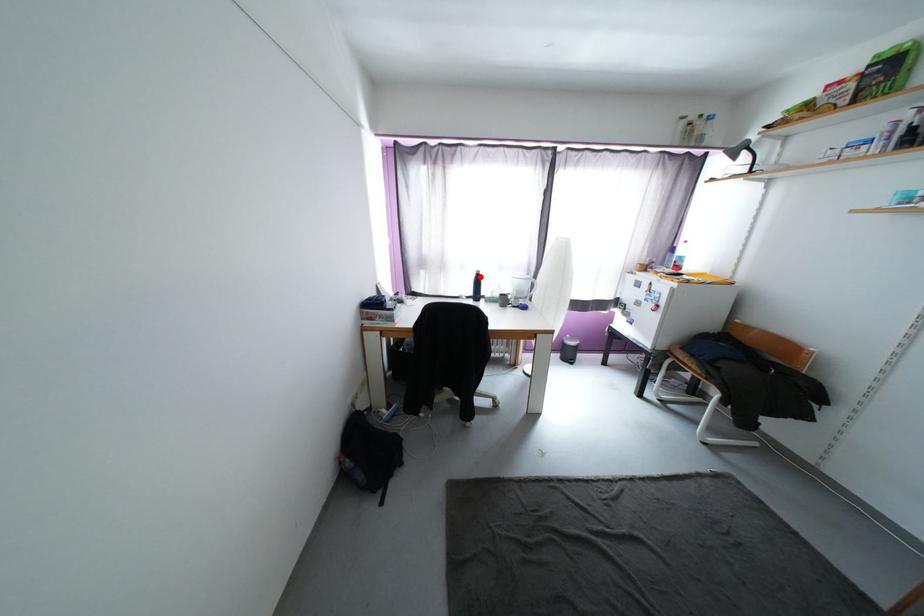
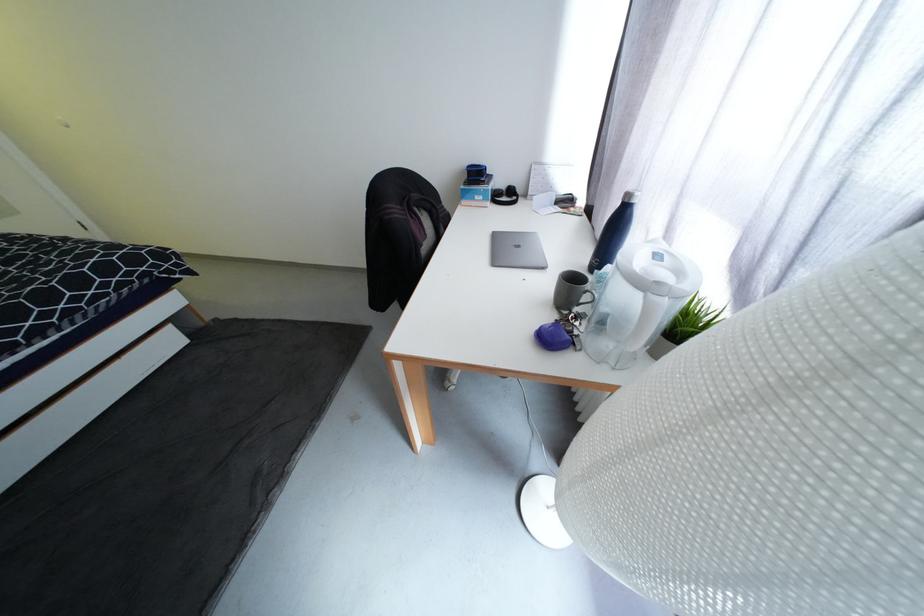
The point at the highlighted location is marked in the first image. Where is the corresponding point in the second image?

(626, 205)